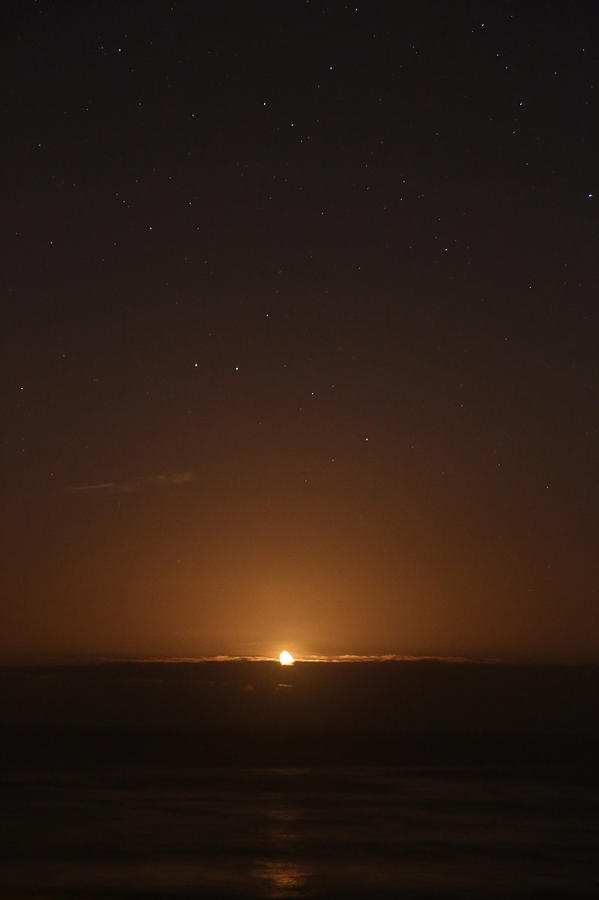
Where is `light`? light is located at coordinates (285, 657).